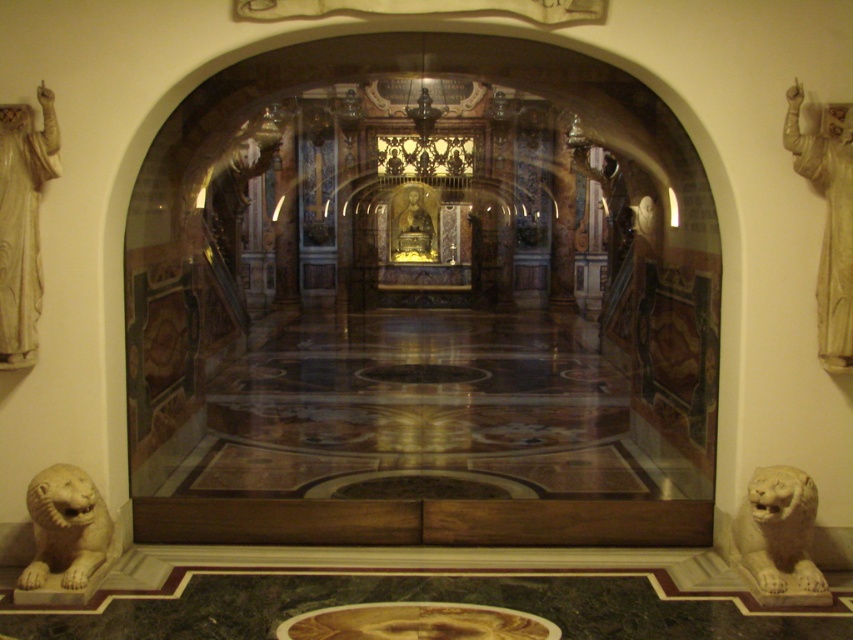
Consider the image. You are standing in the entrance of the chapel and see the white marble lion at lower right and the gold polished statue at center. Which object is nearer to you?

The white marble lion at lower right is closer to the viewer than the gold polished statue at center.

You are standing in the chapel and want to place a small statue exactly at the point marked as point (67,528). What object is located at that point?

The point (67,528) is on the white marble lion at lower left.